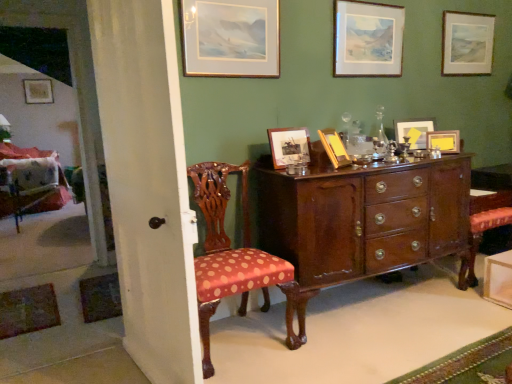
Question: Considering the positions of polka dot fabric chair at left, placed as the 1th chair when sorted from left to right, and wooden picture frame at center, the sixth picture frame viewed from the right, in the image, is polka dot fabric chair at left, placed as the 1th chair when sorted from left to right, bigger or smaller than wooden picture frame at center, the sixth picture frame viewed from the right,?

Choices:
 (A) big
 (B) small

Answer: (A)

Question: Is polka dot fabric chair at left, which is the 2th chair in front-to-back order, spatially inside wooden picture frame at center, positioned as the 3th picture frame in front-to-back order, or outside of it?

Choices:
 (A) inside
 (B) outside

Answer: (B)

Question: Which is nearer to the wooden picture frame at center, which appears as the 2th picture frame when viewed from the front?

Choices:
 (A) matte wooden picture frame at upper right, placed as the 7th picture frame when sorted from front to back
 (B) wooden picture frame at upper center, which is counted as the 5th picture frame, starting from the left
 (C) white painted wood door at left
 (D) polka dot fabric chair at left, the first chair from the right
 (E) matte gold picture frame at upper left, placed as the eighth picture frame when sorted from front to back

Answer: (D)

Question: Which object is positioned closest to the white painted wood door at left?

Choices:
 (A) wooden picture frame at upper center, which is counted as the 5th picture frame, starting from the back
 (B) polka dot fabric chair at left, which is the 1th chair from back to front
 (C) matte gold picture frame at upper left, the 8th picture frame viewed from the right
 (D) matte gold picture frame at upper center, the 7th picture frame in the right-to-left sequence
 (E) matte wooden picture frame at upper right, the eighth picture frame when ordered from left to right

Answer: (D)